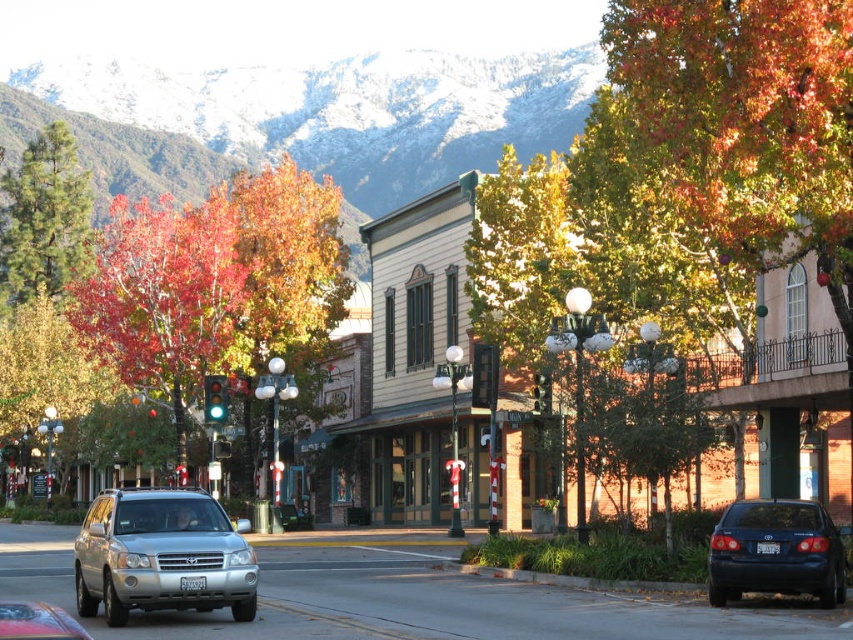
You are a photographer planning to capture the entire snowy mountain at upper center and vivid red leaves at center in one frame. Given that your camera can only fit objects with a combined width of 10 meters, will both fit together?

The snowy mountain at upper center is wider than the vivid red leaves at center. However, since the exact widths aren

You are a photographer standing on the street and want to capture a photo that includes both the snowy mountain at upper center and the metallic silver suv at center. Based on their sizes in the image, which object will appear larger in the photo?

The snowy mountain at upper center is taller than the metallic silver suv at center, so it will appear larger in the photo.